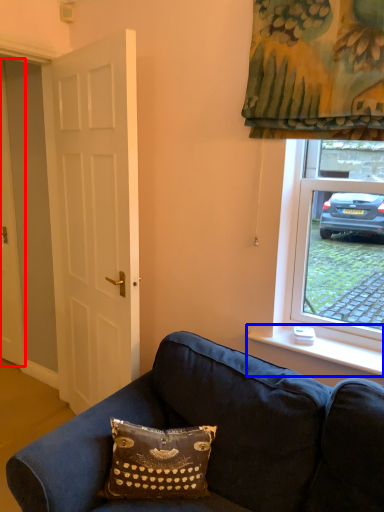
Question: Which point is further to the camera, door (highlighted by a red box) or window sill (highlighted by a blue box)?

Choices:
 (A) door
 (B) window sill

Answer: (A)